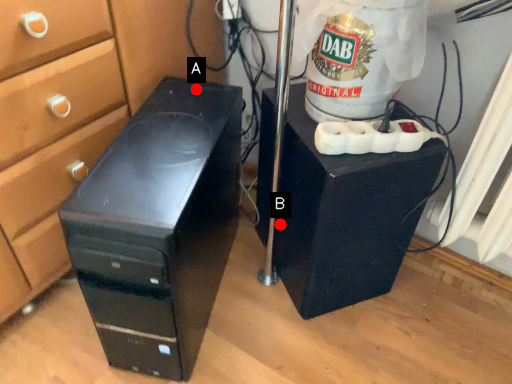
Question: Two points are circled on the image, labeled by A and B beside each circle. Which point is farther to the camera?

Choices:
 (A) A is further
 (B) B is further

Answer: (B)